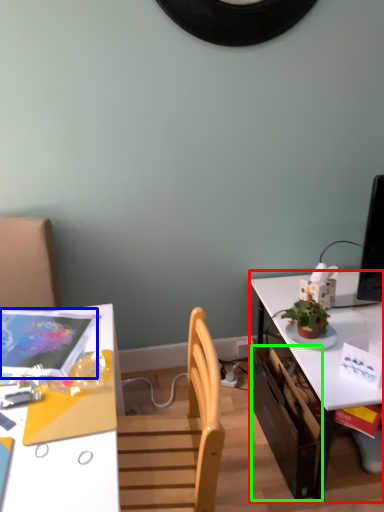
Question: Based on their relative distances, which object is farther from table (highlighted by a red box)? Choose from magazine (highlighted by a blue box) and drawer (highlighted by a green box).

Choices:
 (A) magazine
 (B) drawer

Answer: (A)